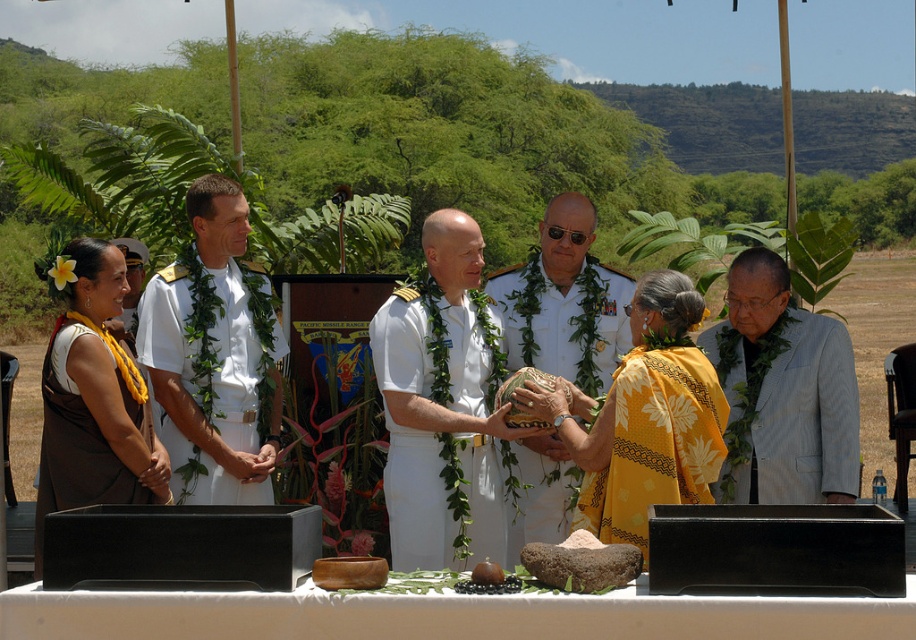
Question: Can you confirm if light gray fabric at right is thinner than brown fabric robe at lower left?

Choices:
 (A) no
 (B) yes

Answer: (A)

Question: Estimate the real-world distances between objects in this image. Which object is closer to the yellow woven fabric at left?

Choices:
 (A) white uniform at center
 (B) smooth brown rock at center

Answer: (A)

Question: Can you confirm if white matte table at center is positioned above light gray fabric at right?

Choices:
 (A) yes
 (B) no

Answer: (B)

Question: Is yellow woven fabric at left below white uniform at center?

Choices:
 (A) no
 (B) yes

Answer: (B)

Question: Which of the following is the closest to the observer?

Choices:
 (A) brown fabric robe at lower left
 (B) yellow printed fabric at center
 (C) white cotton lei at center
 (D) white uniform at center

Answer: (B)

Question: Which point is closer to the camera?

Choices:
 (A) (737, 387)
 (B) (522, 310)

Answer: (A)